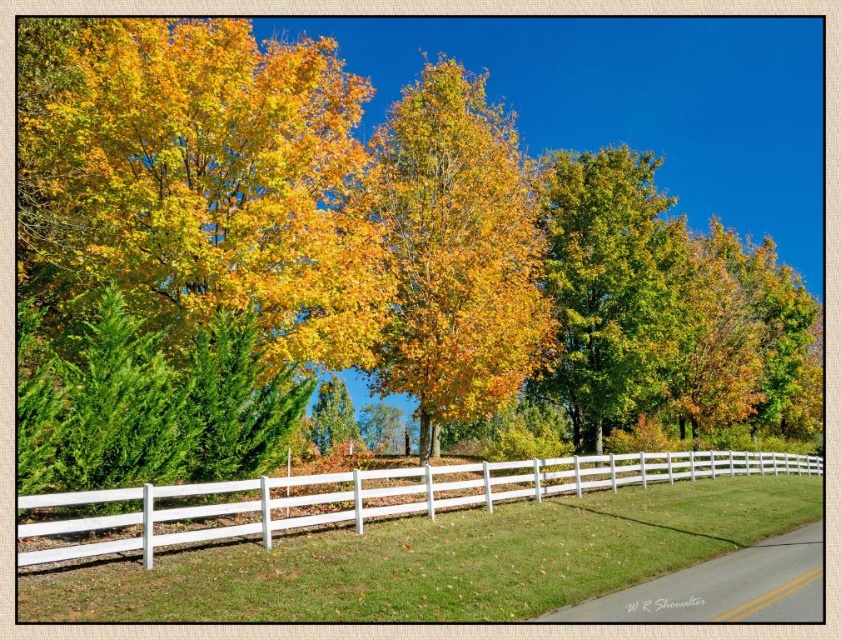
You are standing at the position of the point at coordinates point (538, 244) and want to walk to the point at coordinates point (532, 474). Given that both points are on the road, which direction should you face to walk towards your destination?

Since point (538, 244) is further to the camera than point (532, 474), you should face away from the camera to walk towards your destination.

You are standing on the paved road on the right side of the image. You see the golden yellow leaves at center and the green matte tree at center. Which one is taller?

The golden yellow leaves at center is taller than the green matte tree at center.